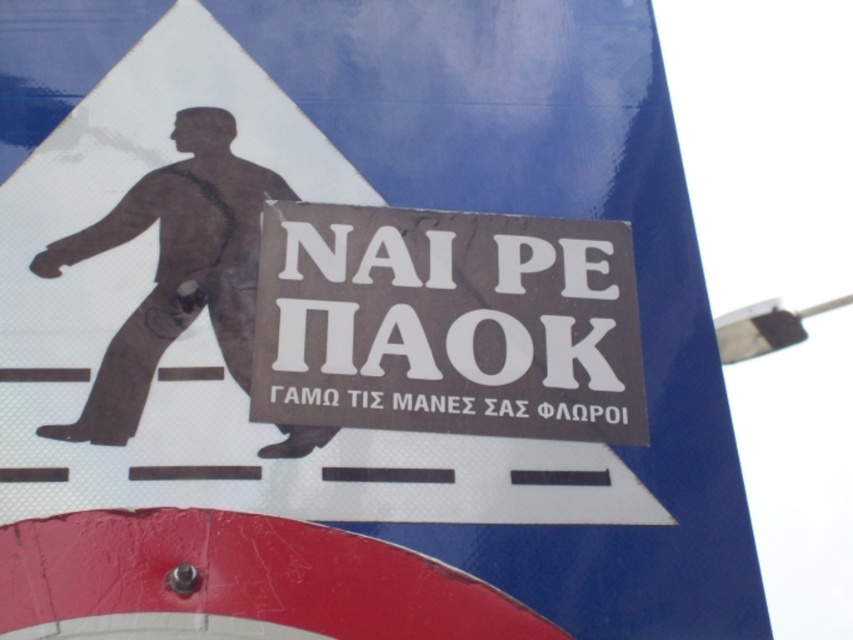
Question: Is white paper sign at center smaller than brown matte figure at center?

Choices:
 (A) yes
 (B) no

Answer: (A)

Question: Among these objects, which one is nearest to the camera?

Choices:
 (A) brown matte figure at center
 (B) white paper sign at center

Answer: (A)

Question: In this image, where is white paper sign at center located relative to brown matte figure at center?

Choices:
 (A) left
 (B) right

Answer: (B)

Question: Among these objects, which one is farthest from the camera?

Choices:
 (A) brown matte figure at center
 (B) white paper sign at center

Answer: (B)

Question: Can you confirm if white paper sign at center is positioned below brown matte figure at center?

Choices:
 (A) no
 (B) yes

Answer: (B)

Question: Which point appears farthest from the camera in this image?

Choices:
 (A) (260, 168)
 (B) (352, 209)

Answer: (A)